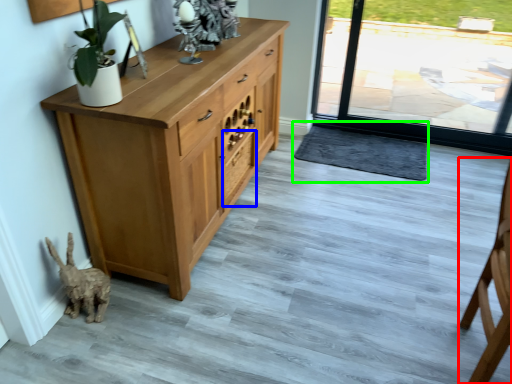
Question: Which object is the farthest from chair (highlighted by a red box)? Choose among these: drawer (highlighted by a blue box) or doormat (highlighted by a green box).

Choices:
 (A) drawer
 (B) doormat

Answer: (A)